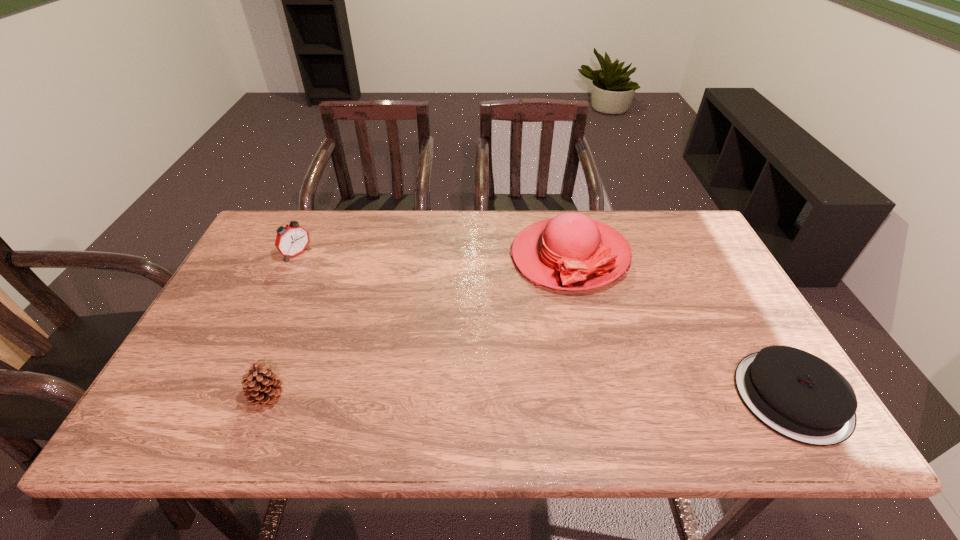
You are a GUI agent. You are given a task and a screenshot of the screen. Output one action in this format:
    pyautogui.click(x=<x>, y=<y>)
    Task: Click on the free area in between the third object from left to right and the leftmost object
    The width and height of the screenshot is (960, 540).
    Given the screenshot: What is the action you would take?
    pyautogui.click(x=433, y=255)

Where is `blank region between the alarm clock and the pancake`? The height and width of the screenshot is (540, 960). blank region between the alarm clock and the pancake is located at coordinates (544, 326).

Identify the location of vacant space in between the shortest object and the alarm clock. This screenshot has width=960, height=540. (544, 326).

Where is `free space between the pinecone and the pancake`? The image size is (960, 540). free space between the pinecone and the pancake is located at coordinates (529, 397).

At what (x,y) coordinates should I click in order to perform the action: click on free space between the third object from right to left and the leftmost object. Please return your answer as a coordinate pair (x, y). Image resolution: width=960 pixels, height=540 pixels. Looking at the image, I should click on click(x=282, y=326).

I want to click on free space between the leftmost object and the rightmost object, so click(x=544, y=326).

Image resolution: width=960 pixels, height=540 pixels. Identify the location of vacant point located between the pinecone and the tallest object. (418, 327).

I want to click on blank region between the alarm clock and the hat, so click(433, 255).

Select which object appears as the third closest to the leftmost object. Please provide its 2D coordinates. Your answer should be formatted as a tuple, i.e. [(x, y)], where the tuple contains the x and y coordinates of a point satisfying the conditions above.

[(799, 396)]

Locate an element on the screen. The height and width of the screenshot is (540, 960). object that is the second closest to the pancake is located at coordinates (261, 387).